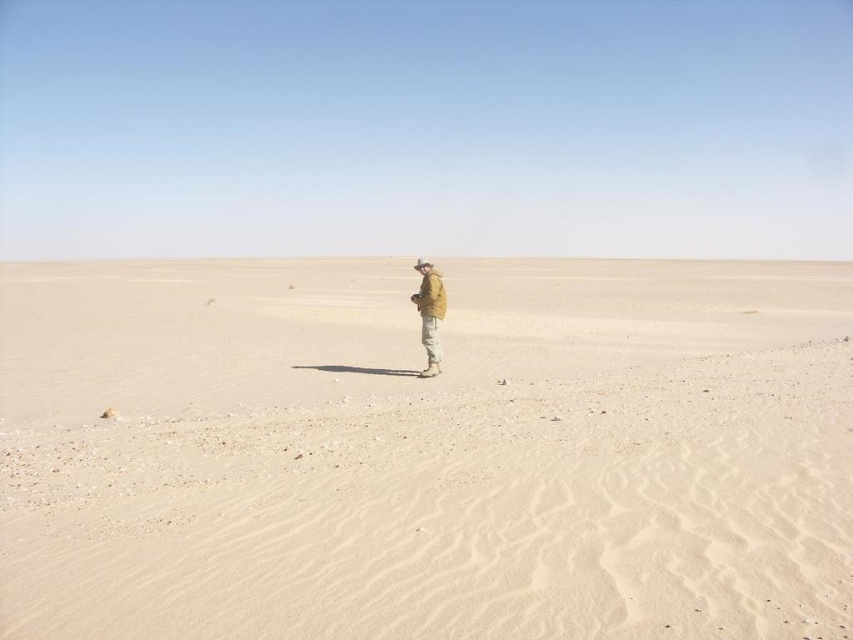
You are a desert explorer and you see the light beige sand at center and the tan fabric jacket at center. Which object is wider?

The light beige sand at center is wider than the tan fabric jacket at center according to the description.

You are a desert explorer navigating through the desert. You have two points marked on your map at coordinates point (364, 596) and point (428, 317). Which point is closer to you if you are facing the direction of the horizon?

Point (364, 596) is in front of point (428, 317), so it is closer to you when facing the horizon.